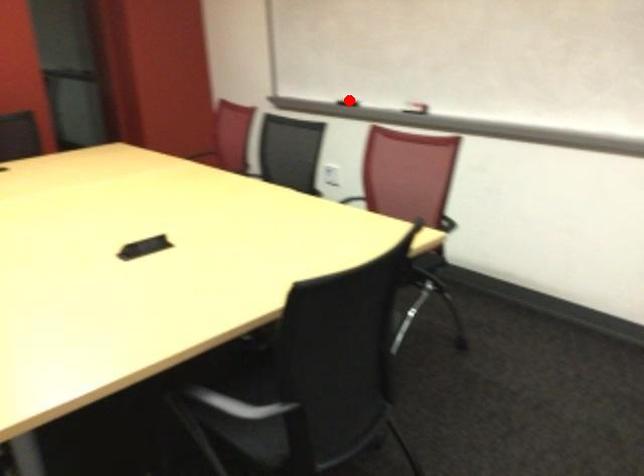
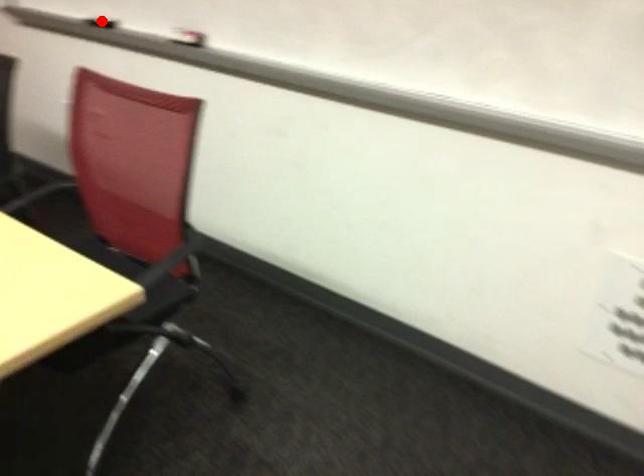
From the picture: I am providing you with two images of the same scene from different viewpoints. A red point is marked on the first image and another point is marked on the second image. Is the marked point in image1 the same physical position as the marked point in image2?

Yes